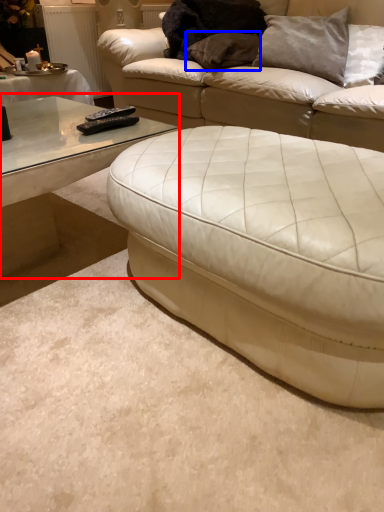
Question: Among these objects, which one is nearest to the camera, coffee table (highlighted by a red box) or pillow (highlighted by a blue box)?

Choices:
 (A) coffee table
 (B) pillow

Answer: (A)